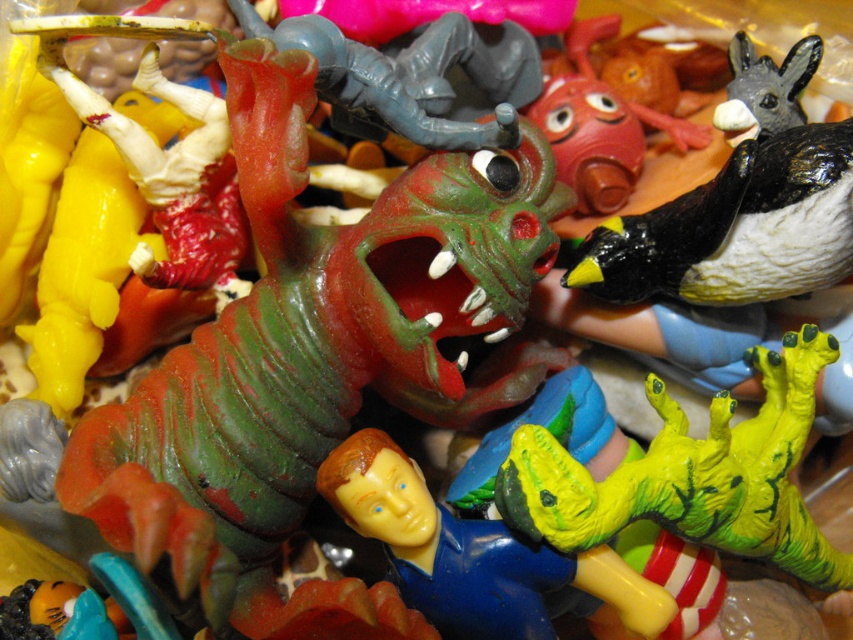
The image size is (853, 640). Find the location of `shiny black bird at center`. shiny black bird at center is located at coordinates (692, 476).

How far apart are shiny black bird at center and black matte penguin at upper right?

shiny black bird at center and black matte penguin at upper right are 4.77 inches apart.

At what (x,y) coordinates should I click in order to perform the action: click on shiny black bird at center. Please return your answer as a coordinate pair (x, y). Looking at the image, I should click on (692, 476).

At what (x,y) coordinates should I click in order to perform the action: click on shiny black bird at center. Please return your answer as a coordinate pair (x, y). This screenshot has width=853, height=640. Looking at the image, I should click on (692, 476).

Does point (801, 499) come closer to viewer compared to point (438, 612)?

No, (801, 499) is behind (438, 612).

Which is below, shiny black bird at center or yellow matte figure at center?

yellow matte figure at center is lower down.

At what (x,y) coordinates should I click in order to perform the action: click on shiny black bird at center. Please return your answer as a coordinate pair (x, y). The image size is (853, 640). Looking at the image, I should click on (692, 476).

Is black matte penguin at upper right behind yellow matte figure at center?

Yes, black matte penguin at upper right is behind yellow matte figure at center.

Is black matte penguin at upper right to the right of yellow matte figure at center from the viewer's perspective?

Indeed, black matte penguin at upper right is positioned on the right side of yellow matte figure at center.

Where is `black matte penguin at upper right`? The image size is (853, 640). black matte penguin at upper right is located at coordinates 735,228.